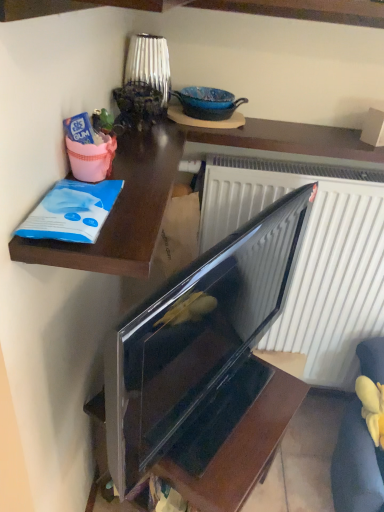
You are a GUI agent. You are given a task and a screenshot of the screen. Output one action in this format:
    pyautogui.click(x=<x>, y=<y>)
    Task: Click on the vacant area situated below shiny blue ceramic bowl at upper center (from a real-world perspective)
    This screenshot has height=512, width=384.
    Given the screenshot: What is the action you would take?
    pyautogui.click(x=211, y=111)